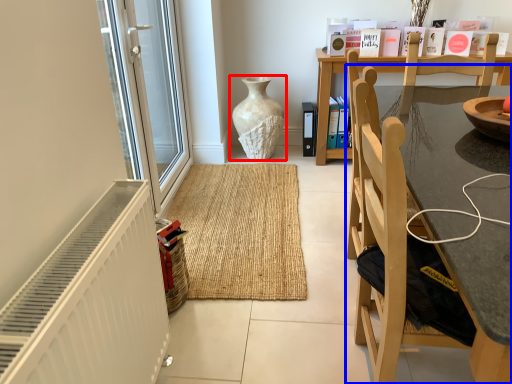
Question: Which point is further to the camera, vase (highlighted by a red box) or chair (highlighted by a blue box)?

Choices:
 (A) vase
 (B) chair

Answer: (A)